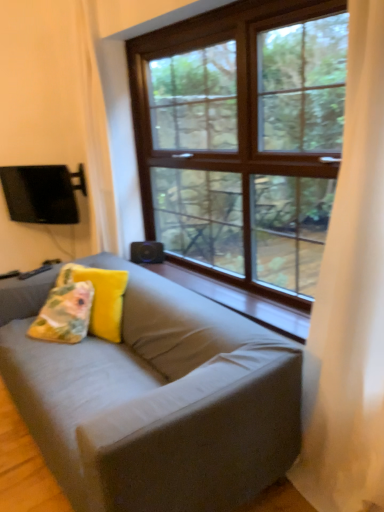
Question: Does wooden at center have a greater width compared to white sheer curtain at right?

Choices:
 (A) yes
 (B) no

Answer: (A)

Question: Does wooden at center have a greater height compared to white sheer curtain at right?

Choices:
 (A) yes
 (B) no

Answer: (B)

Question: From the image's perspective, does wooden at center appear higher than white sheer curtain at right?

Choices:
 (A) no
 (B) yes

Answer: (A)

Question: From the image's perspective, is wooden at center located beneath white sheer curtain at right?

Choices:
 (A) no
 (B) yes

Answer: (B)

Question: Is wooden at center further to the viewer compared to white sheer curtain at right?

Choices:
 (A) no
 (B) yes

Answer: (B)

Question: In terms of width, does yellow fabric pillow at center, positioned as the second pillow in left-to-right order, look wider or thinner when compared to wooden at center?

Choices:
 (A) thin
 (B) wide

Answer: (A)

Question: Based on their positions, is yellow fabric pillow at center, positioned as the second pillow in left-to-right order, located to the left or right of wooden at center?

Choices:
 (A) left
 (B) right

Answer: (A)

Question: Is point (82, 266) positioned closer to the camera than point (306, 303)?

Choices:
 (A) farther
 (B) closer

Answer: (A)

Question: From the image's perspective, is yellow fabric pillow at center, the first pillow when ordered from right to left, positioned above or below wooden at center?

Choices:
 (A) above
 (B) below

Answer: (B)

Question: Would you say white sheer curtain at right is to the left or to the right of wooden at center in the picture?

Choices:
 (A) left
 (B) right

Answer: (B)

Question: Is white sheer curtain at right taller or shorter than wooden at center?

Choices:
 (A) tall
 (B) short

Answer: (A)

Question: From a real-world perspective, relative to wooden at center, is white sheer curtain at right vertically above or below?

Choices:
 (A) below
 (B) above

Answer: (B)

Question: Looking at the image, does white sheer curtain at right seem bigger or smaller compared to wooden at center?

Choices:
 (A) big
 (B) small

Answer: (A)

Question: Considering their positions, is black matte speaker at center located in front of or behind yellow fabric pillow at center, positioned as the second pillow in left-to-right order?

Choices:
 (A) front
 (B) behind

Answer: (B)

Question: From the image's perspective, is black matte speaker at center above or below yellow fabric pillow at center, positioned as the second pillow in left-to-right order?

Choices:
 (A) above
 (B) below

Answer: (A)